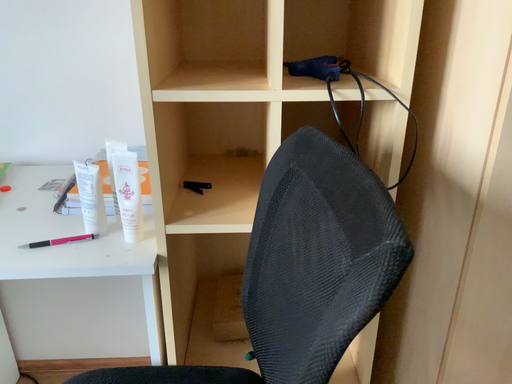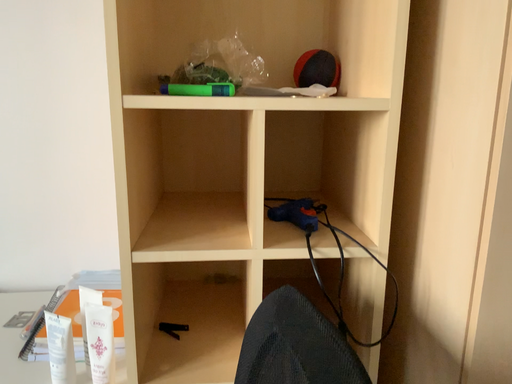
Question: How did the camera likely rotate when shooting the video?

Choices:
 (A) rotated upward
 (B) rotated downward

Answer: (A)